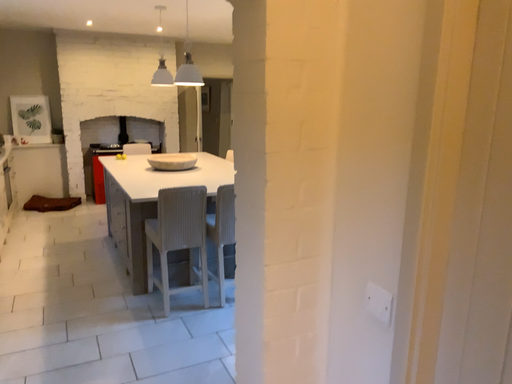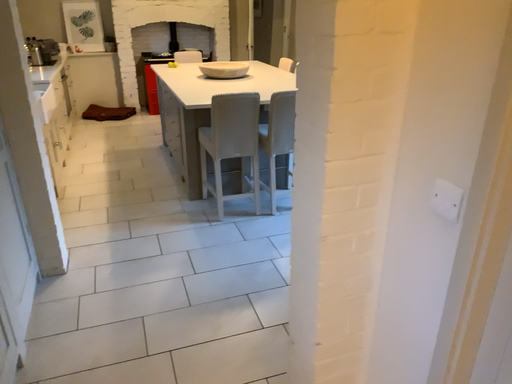
Question: Which way did the camera rotate in the video?

Choices:
 (A) rotated upward
 (B) rotated downward

Answer: (B)